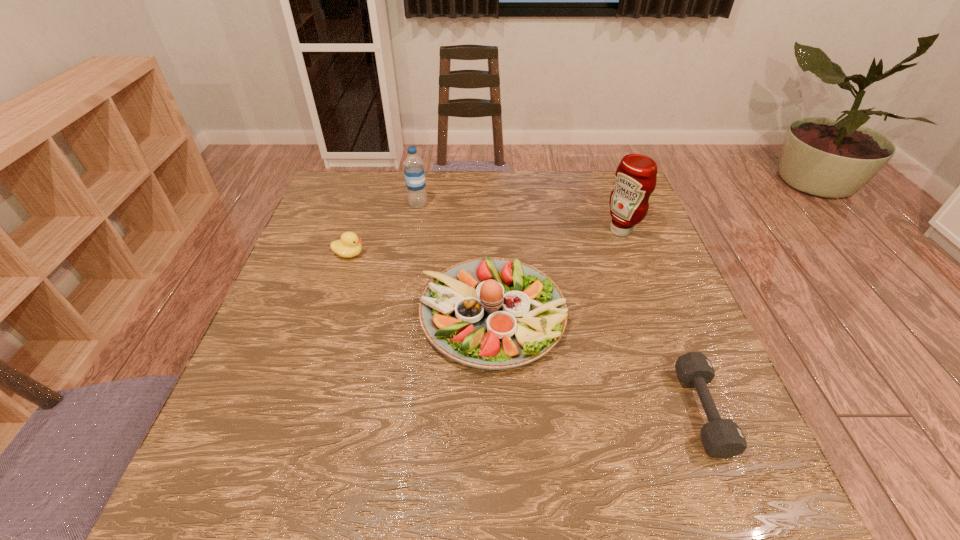
Image resolution: width=960 pixels, height=540 pixels. Identify the location of the second farthest object. (636, 176).

Identify the location of condiment. Image resolution: width=960 pixels, height=540 pixels. (636, 176).

Identify the location of the fourth shortest object. The width and height of the screenshot is (960, 540). (413, 165).

You are a GUI agent. You are given a task and a screenshot of the screen. Output one action in this format:
    pyautogui.click(x=<x>, y=<y>)
    Task: Click on the fourth object from right to left
    The image size is (960, 540).
    Given the screenshot: What is the action you would take?
    pyautogui.click(x=413, y=165)

Find the location of `the third shortest object`. the third shortest object is located at coordinates (491, 313).

Find the location of `the third object from left to right`. the third object from left to right is located at coordinates (491, 313).

Locate an element on the screen. This screenshot has height=540, width=960. duckling is located at coordinates (349, 245).

You are a GUI agent. You are given a task and a screenshot of the screen. Output one action in this format:
    pyautogui.click(x=<x>, y=<y>)
    Task: Click on the third nearest object
    
    Given the screenshot: What is the action you would take?
    pyautogui.click(x=349, y=245)

Locate an element on the screen. Image resolution: width=960 pixels, height=540 pixels. dumbbell is located at coordinates (722, 438).

Identify the location of vacant space located 0.390m on the left of the fourth nearest object. The height and width of the screenshot is (540, 960). (465, 231).